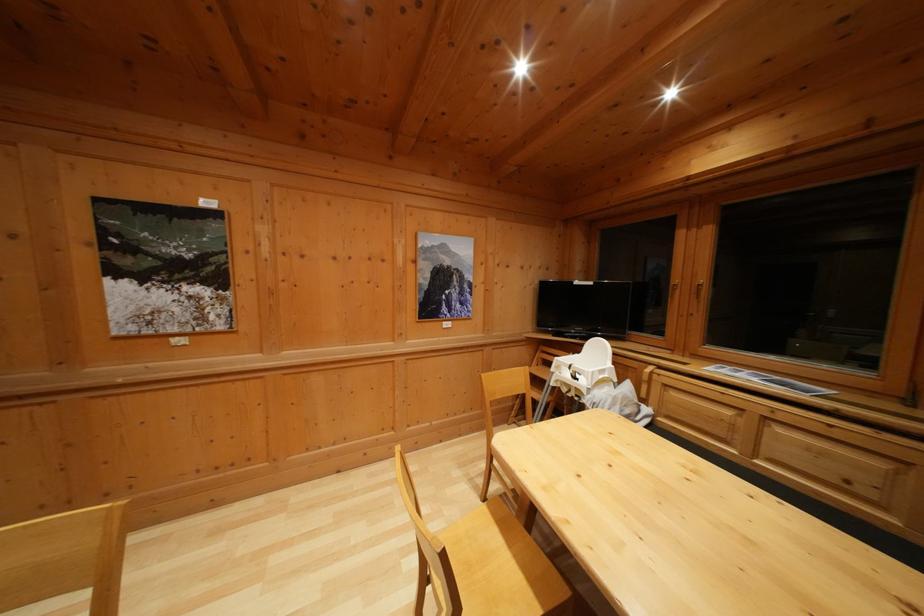
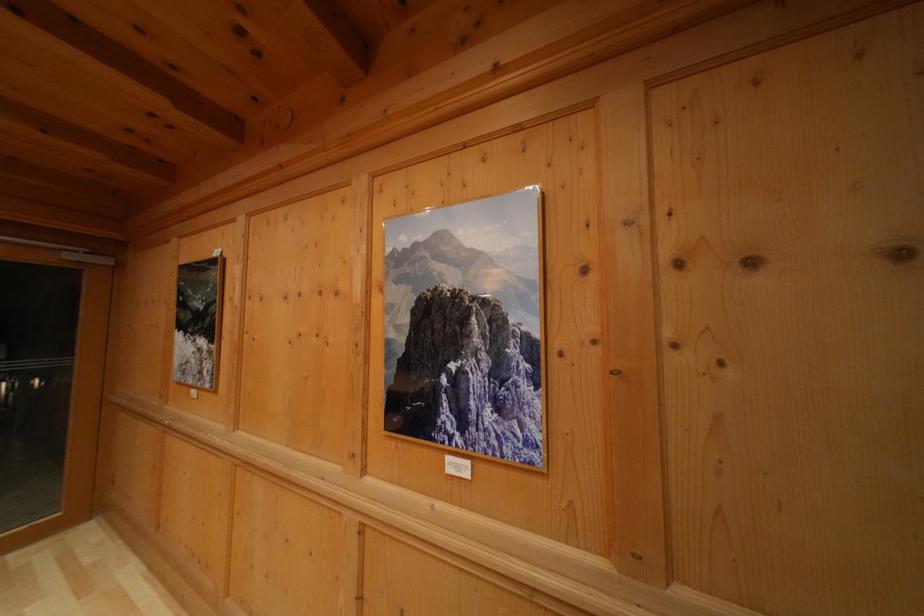
The point at [220,231] is marked in the first image. Where is the corresponding point in the second image?

(222, 281)